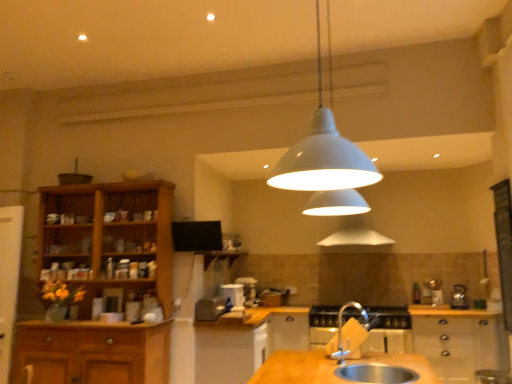
What do you see at coordinates (376, 373) in the screenshot?
I see `silver metallic sink at lower center` at bounding box center [376, 373].

Where is `wooden cabinet at center, the second cabinetry when ordered from right to left`? This screenshot has width=512, height=384. wooden cabinet at center, the second cabinetry when ordered from right to left is located at coordinates (246, 342).

The width and height of the screenshot is (512, 384). I want to click on wooden cabinet at left, placed as the third cabinetry when sorted from right to left, so click(x=109, y=237).

This screenshot has width=512, height=384. I want to click on silver metallic sink at lower center, so click(376, 373).

Is metallic silver gas stove at center located outside white matte pendant light at center?

Absolutely, metallic silver gas stove at center is external to white matte pendant light at center.

How distant is metallic silver gas stove at center from white matte pendant light at center?

metallic silver gas stove at center is 5.06 meters from white matte pendant light at center.

At what (x,y) coordinates should I click in order to perform the action: click on lamp that appears above the metallic silver gas stove at center (from the image's perspective). Please return your answer as a coordinate pair (x, y). The height and width of the screenshot is (384, 512). Looking at the image, I should click on (323, 154).

Which of these two, metallic silver gas stove at center or white matte pendant light at center, is bigger?

metallic silver gas stove at center is bigger.

Is white matte pendant light at center positioned far away from satin silver kettle at center, acting as the third appliance starting from the right?

That's right, there is a large distance between white matte pendant light at center and satin silver kettle at center, acting as the third appliance starting from the right.

Consider the image. Considering the positions of objects white matte pendant light at center and satin silver kettle at center, acting as the second appliance starting from the left, in the image provided, who is more to the left, white matte pendant light at center or satin silver kettle at center, acting as the second appliance starting from the left,?

Positioned to the left is satin silver kettle at center, acting as the second appliance starting from the left.

Who is smaller, white matte pendant light at center or satin silver kettle at center, acting as the second appliance starting from the left?

satin silver kettle at center, acting as the second appliance starting from the left, is smaller.

From a real-world perspective, is white matte pendant light at center physically above satin silver kettle at center, acting as the second appliance starting from the left?

Yes, from a real-world perspective, white matte pendant light at center is over satin silver kettle at center, acting as the second appliance starting from the left

In terms of width, does white glossy coffee cup at center, which ranks as the 2th appliance in right-to-left order, look wider or thinner when compared to satin silver kettle at center, acting as the second appliance starting from the left?

Clearly, white glossy coffee cup at center, which ranks as the 2th appliance in right-to-left order, has less width compared to satin silver kettle at center, acting as the second appliance starting from the left.

Which is in front, point (219, 291) or point (204, 319)?

The point (204, 319) is more forward.

What's the angular difference between white glossy coffee cup at center, which ranks as the 2th appliance in right-to-left order, and satin silver kettle at center, acting as the second appliance starting from the left,'s facing directions?

The facing directions of white glossy coffee cup at center, which ranks as the 2th appliance in right-to-left order, and satin silver kettle at center, acting as the second appliance starting from the left, are 2.1 degrees apart.

From the image's perspective, is white matte pendant light at center above or below silver metallic tap at lower center?

white matte pendant light at center is situated higher than silver metallic tap at lower center in the image.

Where is `tap below the white matte pendant light at center (from the image's perspective)`? This screenshot has height=384, width=512. tap below the white matte pendant light at center (from the image's perspective) is located at coordinates (348, 333).

Does white matte pendant light at center touch silver metallic tap at lower center?

white matte pendant light at center is not next to silver metallic tap at lower center, and they're not touching.

Is wooden cabinet at center, the second cabinetry when ordered from right to left, touching white glossy cabinet at left, which is the 1th appliance in left-to-right order?

wooden cabinet at center, the second cabinetry when ordered from right to left, and white glossy cabinet at left, which is the 1th appliance in left-to-right order, are not in contact.

Considering their positions, is wooden cabinet at center, the second cabinetry when ordered from right to left, located in front of or behind white glossy cabinet at left, which is the 1th appliance in left-to-right order?

wooden cabinet at center, the second cabinetry when ordered from right to left, is positioned closer to the viewer than white glossy cabinet at left, which is the 1th appliance in left-to-right order.

In the scene shown: Considering the positions of objects wooden cabinet at center, positioned as the second cabinetry in left-to-right order, and white glossy cabinet at left, which is the 1th appliance in left-to-right order, in the image provided, who is more to the left, wooden cabinet at center, positioned as the second cabinetry in left-to-right order, or white glossy cabinet at left, which is the 1th appliance in left-to-right order,?

white glossy cabinet at left, which is the 1th appliance in left-to-right order.

Does wooden cabinet at center, the second cabinetry when ordered from right to left, have a lesser height compared to white glossy cabinet at left, the 4th appliance from the right?

Yes.

Is wooden shelf at center oriented away from white glossy cabinet at lower right, marked as the 1th cabinetry in a right-to-left arrangement?

No, white glossy cabinet at lower right, marked as the 1th cabinetry in a right-to-left arrangement, is not at the back of wooden shelf at center.

Considering the points (207, 253) and (431, 350), which point is behind, point (207, 253) or point (431, 350)?

The point (431, 350) is farther from the camera.

Is wooden shelf at center beside white glossy cabinet at lower right, which is counted as the third cabinetry, starting from the left?

There is a gap between wooden shelf at center and white glossy cabinet at lower right, which is counted as the third cabinetry, starting from the left.

In the scene shown: Is white glossy coffee cup at center, which ranks as the 2th appliance in right-to-left order, not close to wooden cabinet at left, placed as the third cabinetry when sorted from right to left?

Yes, white glossy coffee cup at center, which ranks as the 2th appliance in right-to-left order, and wooden cabinet at left, placed as the third cabinetry when sorted from right to left, are located far from each other.

Is point (226, 291) positioned before point (50, 203)?

No, it is not.

From a real-world perspective, does white glossy coffee cup at center, placed as the 3th appliance when sorted from left to right, stand above wooden cabinet at left, placed as the third cabinetry when sorted from right to left?

No, from a real-world perspective, white glossy coffee cup at center, placed as the 3th appliance when sorted from left to right, is not over wooden cabinet at left, placed as the third cabinetry when sorted from right to left

Identify the location of lamp located above the metallic silver gas stove at center (from a real-world perspective). This screenshot has width=512, height=384. (323, 154).

Locate an element on the screen. The width and height of the screenshot is (512, 384). lamp above the satin silver kettle at center, acting as the second appliance starting from the left (from the image's perspective) is located at coordinates (323, 154).

Considering their positions, is wooden cabinet at left, placed as the third cabinetry when sorted from right to left, positioned further to white glossy coffee cup at center, which ranks as the 2th appliance in right-to-left order, than satin silver kettle at center, acting as the second appliance starting from the left?

Among the two, wooden cabinet at left, placed as the third cabinetry when sorted from right to left, is located further to white glossy coffee cup at center, which ranks as the 2th appliance in right-to-left order.

Looking at the image, which one is located further to satin silver kettle at center, acting as the second appliance starting from the left, white matte pendant light at center or metallic silver gas stove at center?

white matte pendant light at center.

Looking at the image, which one is located further to white matte pendant light at center, white glossy cabinet at left, the 4th appliance from the right, or white glossy coffee cup at center, which ranks as the 2th appliance in right-to-left order?

white glossy cabinet at left, the 4th appliance from the right.

When comparing their distances from silver metallic sink at lower center, does wooden cabinet at center, positioned as the second cabinetry in left-to-right order, or silver metallic kettle at right, the 4th appliance in the left-to-right sequence, seem further?

silver metallic kettle at right, the 4th appliance in the left-to-right sequence.

Based on their spatial positions, is wooden cabinet at center, the second cabinetry when ordered from right to left, or white glossy coffee cup at center, which ranks as the 2th appliance in right-to-left order, further from white glossy cabinet at left, which is the 1th appliance in left-to-right order?

white glossy coffee cup at center, which ranks as the 2th appliance in right-to-left order, lies further to white glossy cabinet at left, which is the 1th appliance in left-to-right order, than the other object.

When comparing their distances from white glossy coffee cup at center, placed as the 3th appliance when sorted from left to right, does wooden cabinet at left, which is counted as the 1th cabinetry, starting from the left, or wooden shelf at center seem further?

Based on the image, wooden cabinet at left, which is counted as the 1th cabinetry, starting from the left, appears to be further to white glossy coffee cup at center, placed as the 3th appliance when sorted from left to right.

Estimate the real-world distances between objects in this image. Which object is further from silver metallic sink at lower center, white glossy cabinet at lower right, which is counted as the third cabinetry, starting from the left, or white glossy cabinet at left, which is the 1th appliance in left-to-right order?

white glossy cabinet at lower right, which is counted as the third cabinetry, starting from the left, is further to silver metallic sink at lower center.

Which object lies nearer to the anchor point white glossy cabinet at lower right, marked as the 1th cabinetry in a right-to-left arrangement, white matte pendant light at center or silver metallic kettle at right, the 1th appliance positioned from the right?

silver metallic kettle at right, the 1th appliance positioned from the right, is closer to white glossy cabinet at lower right, marked as the 1th cabinetry in a right-to-left arrangement.

This screenshot has height=384, width=512. Identify the location of gas stove between white glossy coffee cup at center, placed as the 3th appliance when sorted from left to right, and silver metallic kettle at right, the 4th appliance in the left-to-right sequence, from left to right. (389, 317).

Locate an element on the screen. This screenshot has height=384, width=512. tap positioned between silver metallic sink at lower center and metallic silver gas stove at center from near to far is located at coordinates (348, 333).

Where is `sink located between white matte pendant light at center and wooden cabinet at left, placed as the third cabinetry when sorted from right to left, in the depth direction`? sink located between white matte pendant light at center and wooden cabinet at left, placed as the third cabinetry when sorted from right to left, in the depth direction is located at coordinates (376, 373).

Locate an element on the screen. This screenshot has width=512, height=384. shelf between wooden cabinet at left, which is counted as the 1th cabinetry, starting from the left, and white glossy cabinet at lower right, which is counted as the third cabinetry, starting from the left is located at coordinates (220, 257).